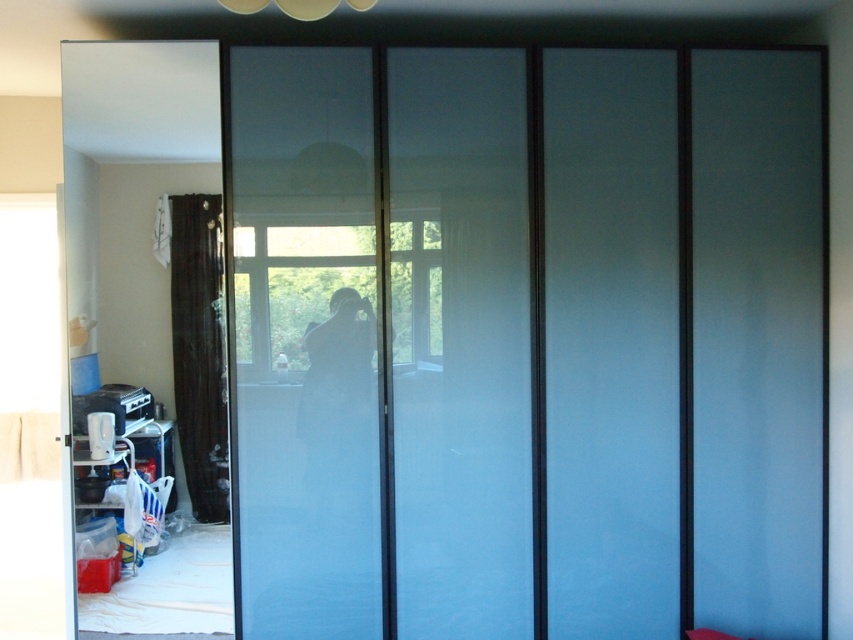
Is point (372, 554) positioned in front of point (201, 193)?

No, (372, 554) is behind (201, 193).

Can you confirm if frosted glass door at center is shorter than brown velvet curtain at left?

No, frosted glass door at center is not shorter than brown velvet curtain at left.

Which is in front, point (267, 230) or point (183, 440)?

Positioned in front is point (267, 230).

Where is `frosted glass door at center`? Image resolution: width=853 pixels, height=640 pixels. frosted glass door at center is located at coordinates (526, 340).